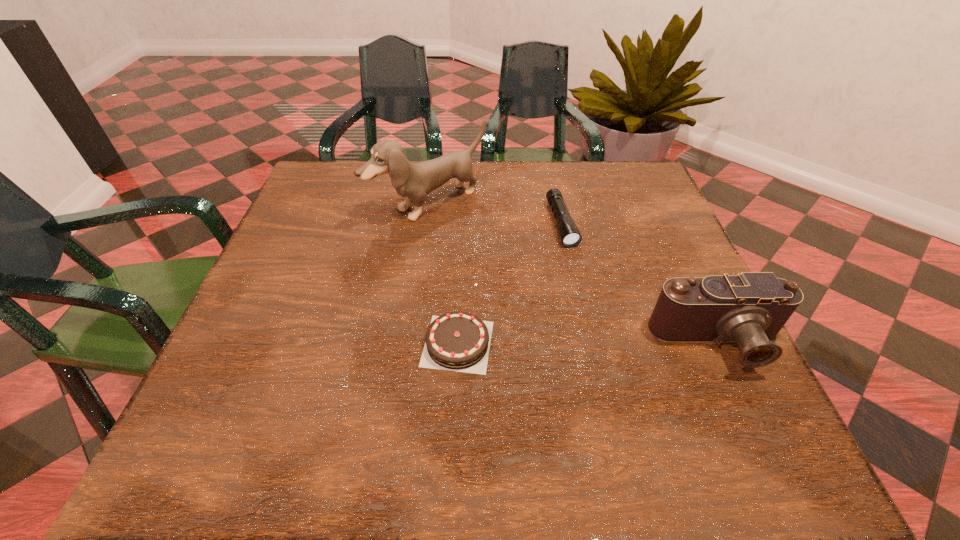
The width and height of the screenshot is (960, 540). In the image, there is a desktop. Identify the location of vacant space at the left edge. (282, 260).

Find the location of a particular element. This screenshot has height=540, width=960. blank space at the right edge of the desktop is located at coordinates point(670,215).

Locate an element on the screen. This screenshot has height=540, width=960. free space at the far left corner of the desktop is located at coordinates click(349, 191).

Find the location of `vacant space at the near left corner of the desktop`. vacant space at the near left corner of the desktop is located at coordinates (273, 387).

In the image, there is a desktop. At what (x,y) coordinates should I click in order to perform the action: click on blank space at the far right corner. Please return your answer as a coordinate pair (x, y). The image size is (960, 540). Looking at the image, I should click on (627, 189).

The height and width of the screenshot is (540, 960). Identify the location of vacant space at the near right corner. (674, 409).

Identify the location of free point between the chocolate cake and the puppy. The image size is (960, 540). (444, 274).

Where is `unoccupied position between the chocolate cake and the rightmost object`? unoccupied position between the chocolate cake and the rightmost object is located at coordinates (588, 343).

You are a GUI agent. You are given a task and a screenshot of the screen. Output one action in this format:
    pyautogui.click(x=<x>, y=<y>)
    Task: Click on the free space between the puppy and the second tallest object
    
    Given the screenshot: What is the action you would take?
    pyautogui.click(x=574, y=274)

Locate an element on the screen. This screenshot has height=540, width=960. free space between the chocolate cake and the second tallest object is located at coordinates (588, 343).